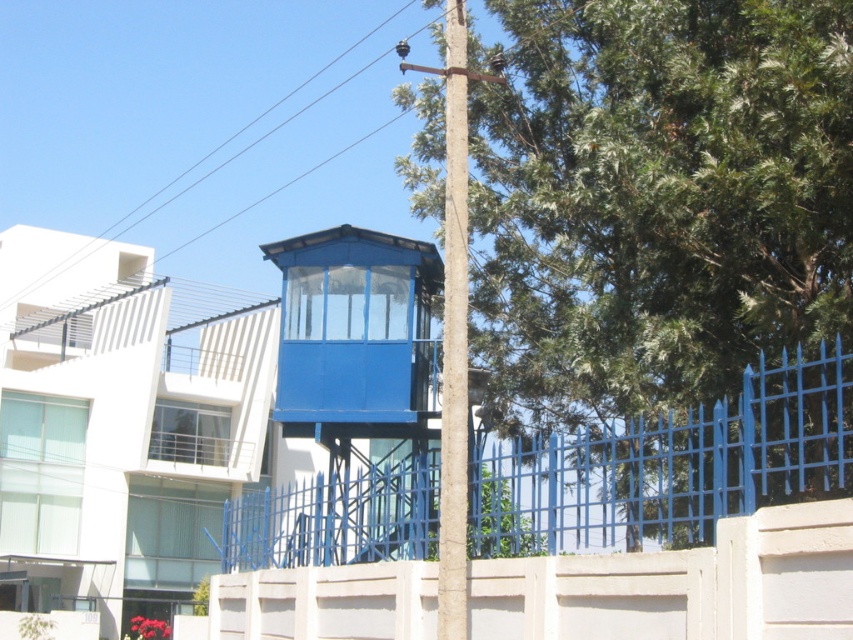
Looking at this image, you are a maintenance worker inspecting the structure. You notice the smooth wire at upper center and the brown textured pole at center. Which object is positioned higher in the scene?

The smooth wire at upper center is located above the brown textured pole at center, so it is positioned higher.

Consider the image. You are a construction worker inspecting the guardhouse structure. You notice two elements on the structure. Which one is larger in size between the smooth wire at upper center and the brown textured pole at center?

The smooth wire at upper center is bigger than the brown textured pole at center according to the description.

You are standing in front of the guardhouse and want to take a photo. There are two points marked in the scene, point [196,120] and point [456,582]. Which point is closer to your camera lens?

Point [196,120] is further to the camera than point [456,582], so the point closer to the camera lens is point [456,582].